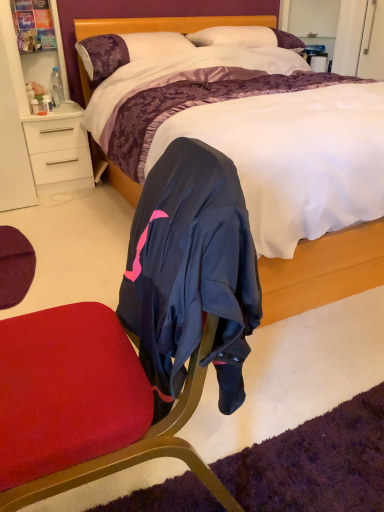
Question: Considering the positions of clear plastic bottle at left and purple satin pillow at upper left, placed as the second pillow when sorted from right to left, in the image, is clear plastic bottle at left taller or shorter than purple satin pillow at upper left, placed as the second pillow when sorted from right to left,?

Choices:
 (A) tall
 (B) short

Answer: (B)

Question: From the image's perspective, relative to purple satin pillow at upper left, the 1th pillow when ordered from left to right, is clear plastic bottle at left above or below?

Choices:
 (A) above
 (B) below

Answer: (B)

Question: Which of these objects is positioned farthest from the satin purple bed at center?

Choices:
 (A) clear plastic bottle at left
 (B) white soft pillow at upper center, acting as the 2th pillow starting from the left
 (C) white glossy drawer at left
 (D) purple satin pillow at upper left, placed as the second pillow when sorted from right to left

Answer: (A)

Question: Estimate the real-world distances between objects in this image. Which object is closer to the clear plastic bottle at left?

Choices:
 (A) satin purple bed at center
 (B) white glossy drawer at left
 (C) purple satin pillow at upper left, placed as the second pillow when sorted from right to left
 (D) white soft pillow at upper center, acting as the 1th pillow starting from the right

Answer: (B)